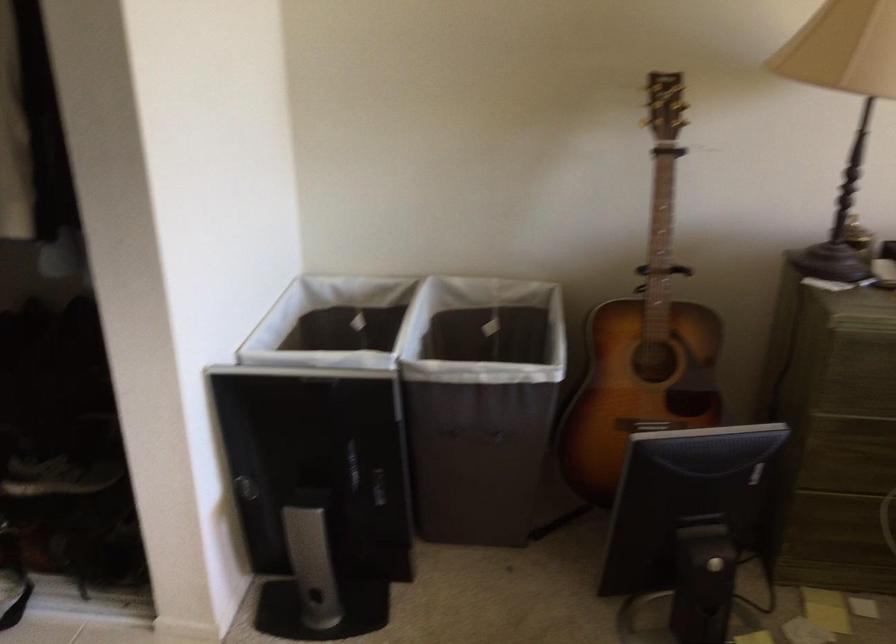
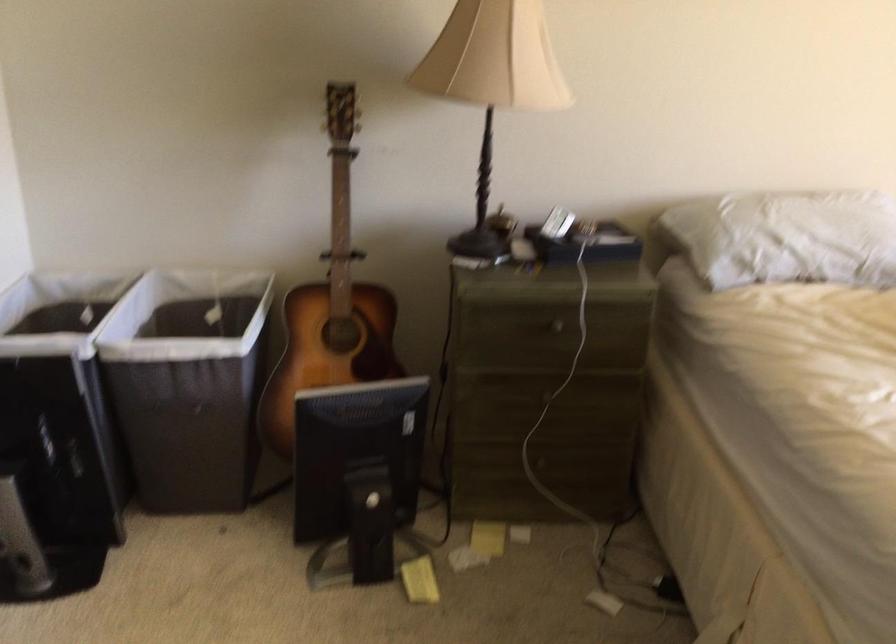
In the second image, find the point that corresponds to point 642,325 in the first image.

(331, 303)